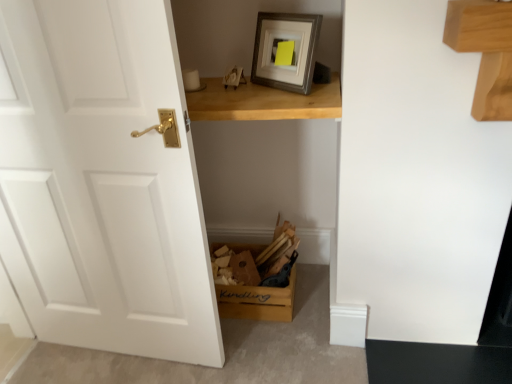
The image size is (512, 384). Identify the location of spots to the right of white matte door at left. (263, 347).